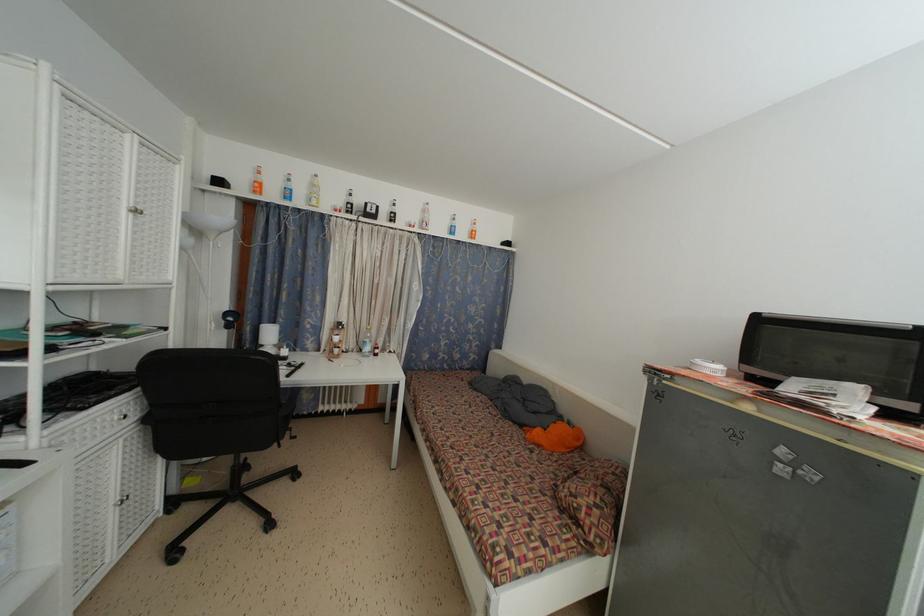
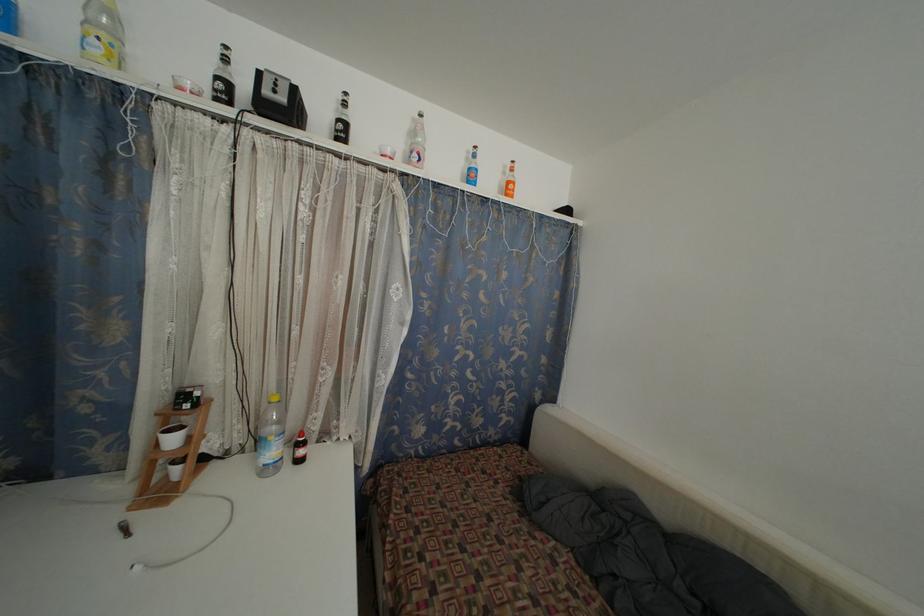
Where in the second image is the point corresponding to pixel 371 209 from the first image?

(263, 79)